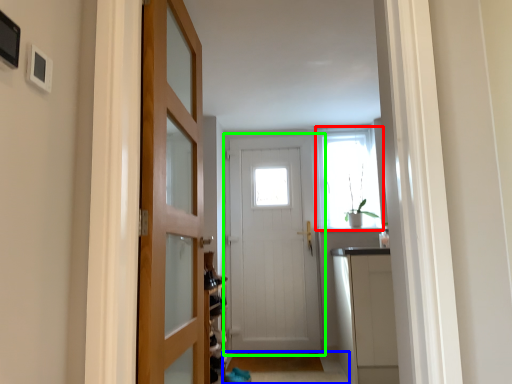
Question: Which object is the farthest from window (highlighted by a red box)? Choose among these: path (highlighted by a blue box) or door (highlighted by a green box).

Choices:
 (A) path
 (B) door

Answer: (A)